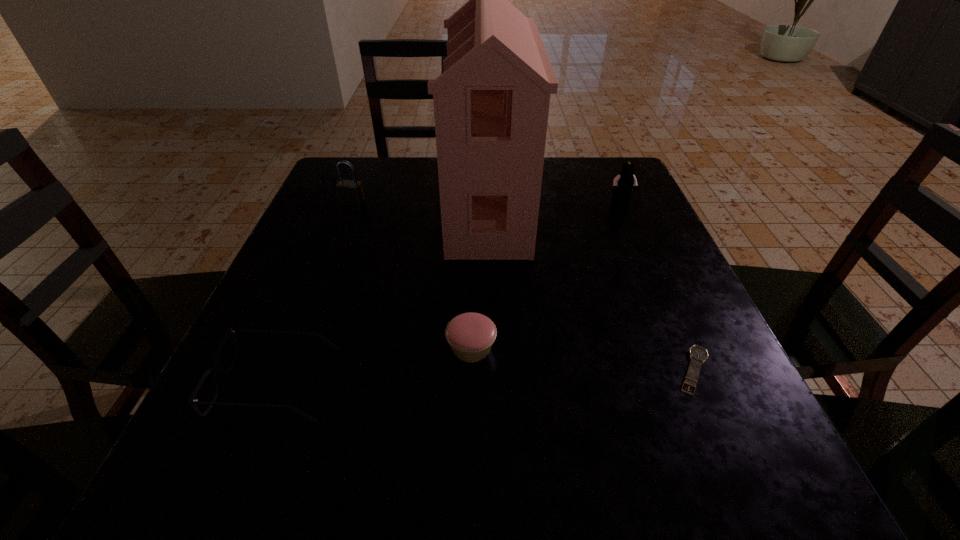
You are a GUI agent. You are given a task and a screenshot of the screen. Output one action in this format:
    pyautogui.click(x=<x>, y=<y>)
    Task: Click on the free space between the cupcake and the watch
    
    Given the screenshot: What is the action you would take?
    pyautogui.click(x=583, y=359)

The width and height of the screenshot is (960, 540). Find the location of `unoccupied area between the tallest object and the shortest object`. unoccupied area between the tallest object and the shortest object is located at coordinates (591, 287).

Identify the location of vacant space that is in between the cupcake and the padlock. Image resolution: width=960 pixels, height=540 pixels. (412, 275).

Locate an element on the screen. free space between the padlock and the tallest object is located at coordinates (420, 203).

Image resolution: width=960 pixels, height=540 pixels. I want to click on vacant space in between the Lego and the spectacles, so click(448, 293).

At what (x,y) coordinates should I click in order to perform the action: click on vacant space that is in between the spectacles and the padlock. Please return your answer as a coordinate pair (x, y). Image resolution: width=960 pixels, height=540 pixels. Looking at the image, I should click on (315, 293).

The width and height of the screenshot is (960, 540). I want to click on vacant area that lies between the padlock and the dollhouse, so click(x=420, y=203).

Select which object is the fourth closest to the Lego. Please provide its 2D coordinates. Your answer should be formatted as a tuple, i.e. [(x, y)], where the tuple contains the x and y coordinates of a point satisfying the conditions above.

[(350, 192)]

Locate which object is the second closest to the shortest object. Please provide its 2D coordinates. Your answer should be formatted as a tuple, i.e. [(x, y)], where the tuple contains the x and y coordinates of a point satisfying the conditions above.

[(491, 103)]

What are the coordinates of `vacant point that satisfies the following two spatial constraints: 1. on the front-facing side of the Lego; 2. on the front-facing side of the dollhouse` in the screenshot? It's located at (622, 204).